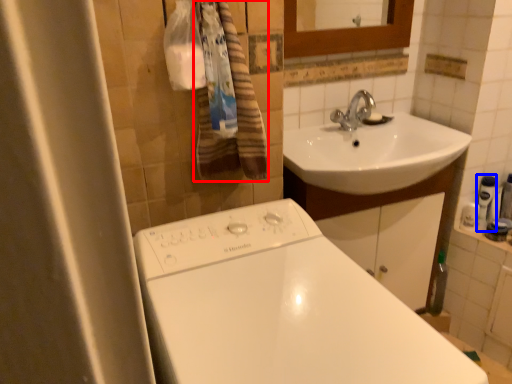
Question: Among these objects, which one is farthest to the camera, bath towel (highlighted by a red box) or toiletry (highlighted by a blue box)?

Choices:
 (A) bath towel
 (B) toiletry

Answer: (B)